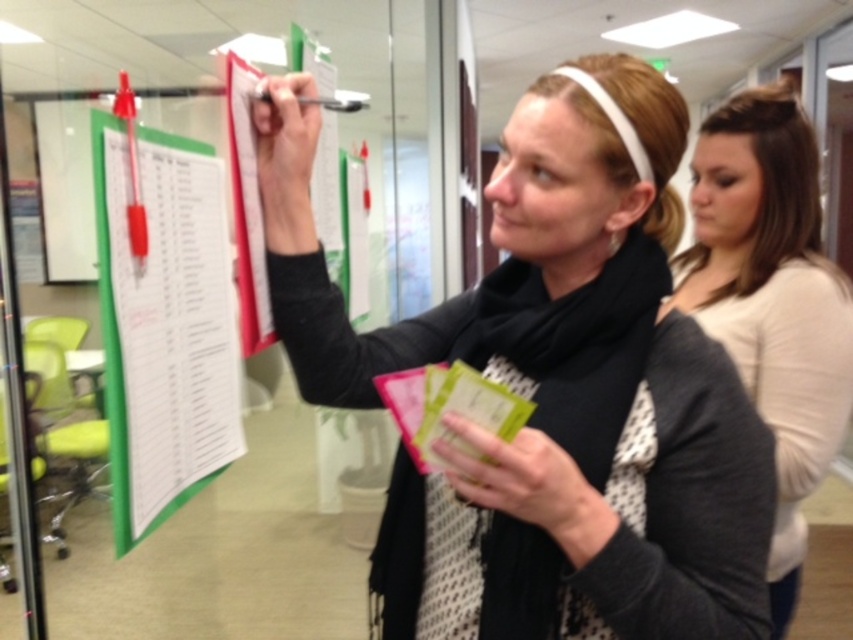
Can you confirm if black matte scarf at upper center is positioned to the right of white matte shirt at upper right?

No, black matte scarf at upper center is not to the right of white matte shirt at upper right.

Which of these two, black matte scarf at upper center or white matte shirt at upper right, stands taller?

white matte shirt at upper right is taller.

Is point (521, 246) more distant than point (743, 227)?

No, (521, 246) is closer to viewer.

Find the location of `black matte scarf at upper center`. black matte scarf at upper center is located at coordinates (560, 369).

Can you confirm if white matte shirt at upper right is smaller than green paperboard at left?

No, white matte shirt at upper right is not smaller than green paperboard at left.

Image resolution: width=853 pixels, height=640 pixels. Identify the location of white matte shirt at upper right. (770, 298).

Between black matte scarf at upper center and green paperboard at left, which one is positioned lower?

black matte scarf at upper center is below.

I want to click on black matte scarf at upper center, so click(x=560, y=369).

This screenshot has height=640, width=853. Find the location of `black matte scarf at upper center`. black matte scarf at upper center is located at coordinates (560, 369).